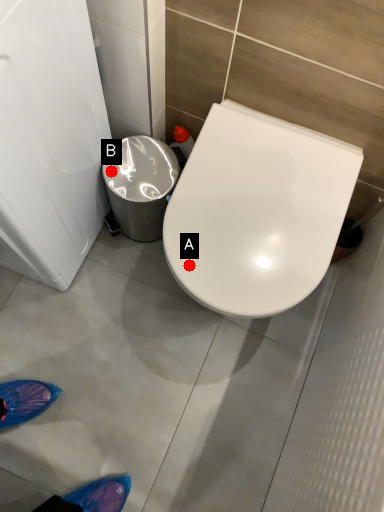
Question: Two points are circled on the image, labeled by A and B beside each circle. Which of the following is the farthest from the observer?

Choices:
 (A) A is further
 (B) B is further

Answer: (B)